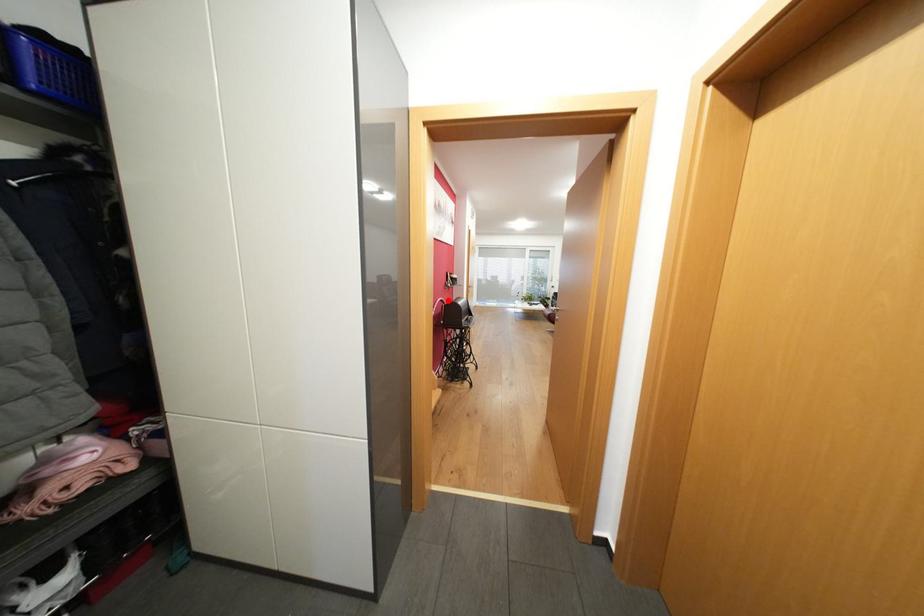
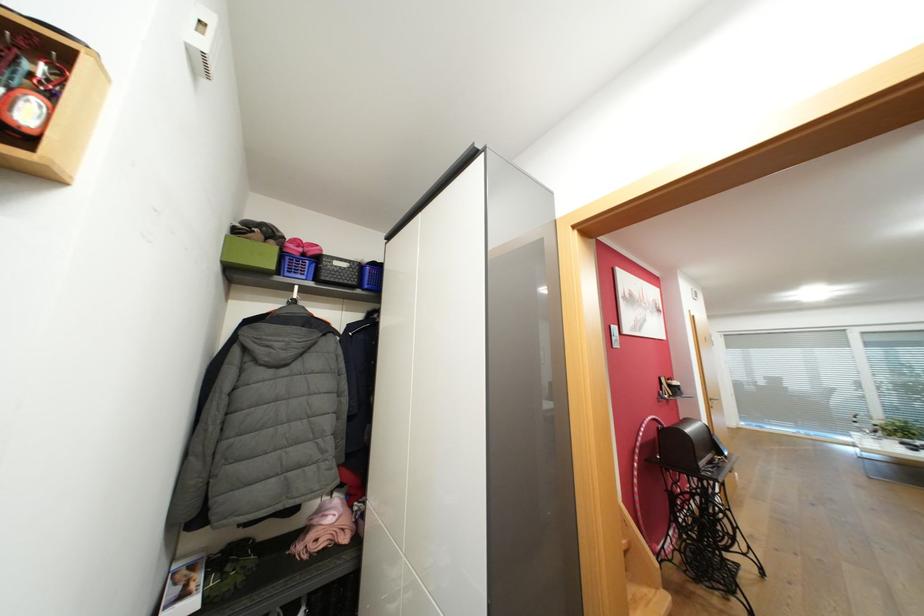
Question: I am providing you with two images of the same scene from different viewpoints. Image1 has a red point marked. In image2, the corresponding 3D location appears at what relative position? Reply with the corresponding letter.

Choices:
 (A) Closer
 (B) Farther

Answer: (B)